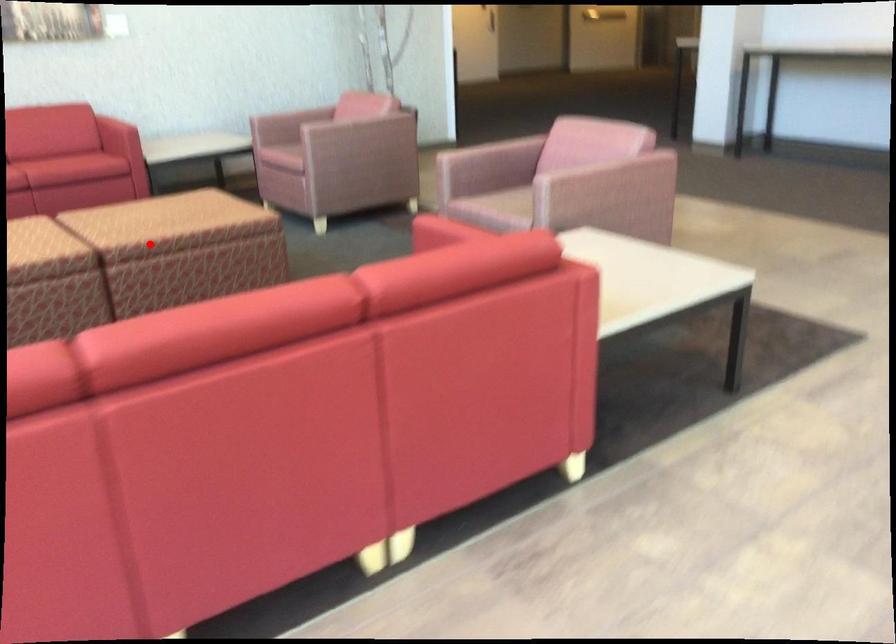
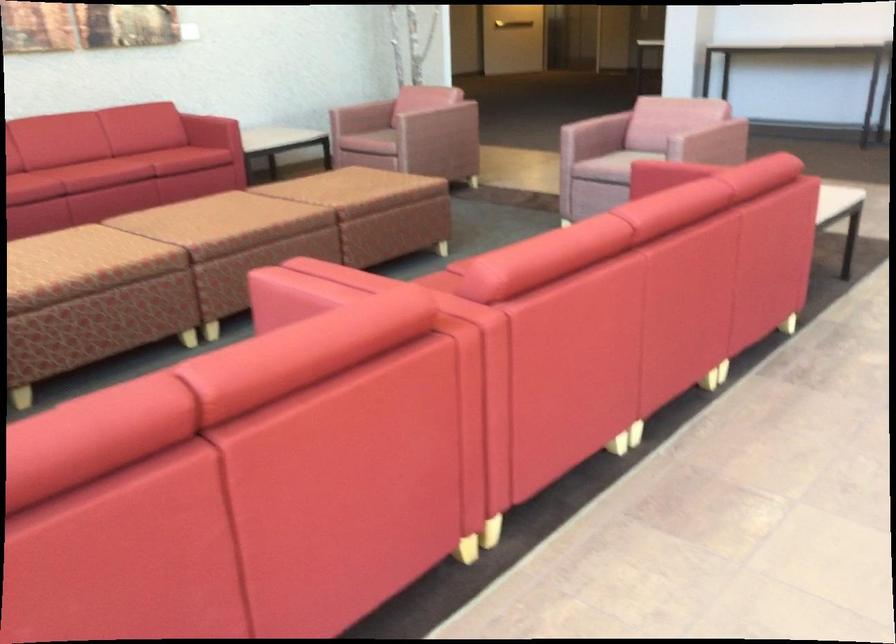
The point at the highlighted location is marked in the first image. Where is the corresponding point in the second image?

(380, 212)